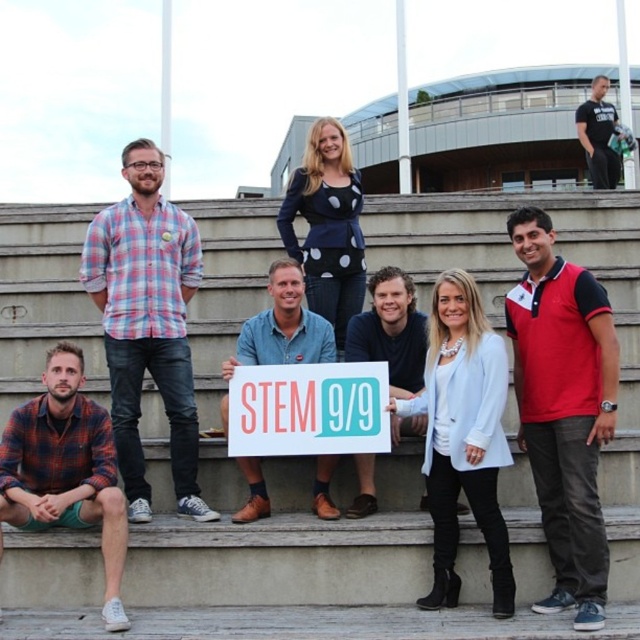
Question: Which is nearer to the light blue fabric jacket at center?

Choices:
 (A) red cotton polo shirt at right
 (B) black cotton t-shirt at upper right
 (C) matte white sign at center
 (D) wooden stairs at center

Answer: (C)

Question: Where is wooden stairs at center located in relation to red cotton polo shirt at right in the image?

Choices:
 (A) above
 (B) below

Answer: (B)

Question: Among these points, which one is nearest to the camera?

Choices:
 (A) (595, 144)
 (B) (451, 371)
 (C) (248, 512)

Answer: (B)

Question: Which object is farther from the camera taking this photo?

Choices:
 (A) plaid shirt at left
 (B) blue denim shirt at center

Answer: (B)

Question: Is wooden stairs at center to the left of plaid shirt at left from the viewer's perspective?

Choices:
 (A) yes
 (B) no

Answer: (B)

Question: Does plaid flannel shirt at lower left have a smaller size compared to matte white sign at center?

Choices:
 (A) no
 (B) yes

Answer: (A)